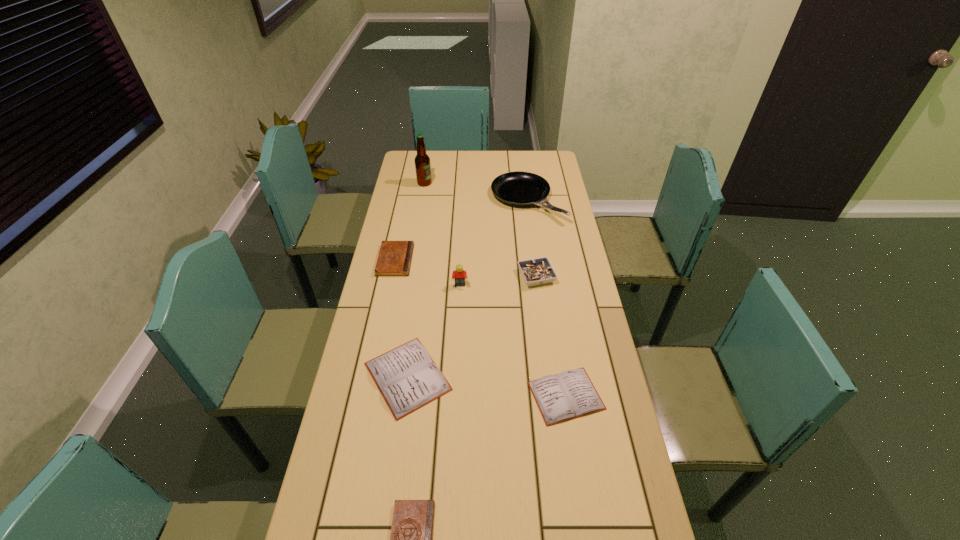
Find the location of a particular element. The image size is (960, 540). the right white diary is located at coordinates (570, 394).

Locate an element on the screen. the rightmost diary is located at coordinates tap(570, 394).

What are the coordinates of `free point located 0.300m on the label of the tallest object` in the screenshot? It's located at (496, 183).

This screenshot has width=960, height=540. Find the location of `blank area located on the face of the Lego`. blank area located on the face of the Lego is located at coordinates (459, 310).

Find the location of a particular element. free spot located 0.070m on the left of the pan is located at coordinates click(475, 200).

Where is `vacant space situated on the back of the ashtray`? The width and height of the screenshot is (960, 540). vacant space situated on the back of the ashtray is located at coordinates (529, 222).

Locate an element on the screen. The image size is (960, 540). vacant space located 0.160m on the front of the left white diary is located at coordinates (393, 482).

The width and height of the screenshot is (960, 540). Find the location of `blank space located on the spine side of the bigger brown diary`. blank space located on the spine side of the bigger brown diary is located at coordinates (445, 260).

You are a GUI agent. You are given a task and a screenshot of the screen. Output one action in this format:
    pyautogui.click(x=<x>, y=<y>)
    Task: Click on the blank area located 0.210m on the front of the rightmost diary
    This screenshot has width=960, height=540.
    Given the screenshot: What is the action you would take?
    pyautogui.click(x=585, y=510)

Locate an element on the screen. beer bottle located at the left edge is located at coordinates (422, 161).